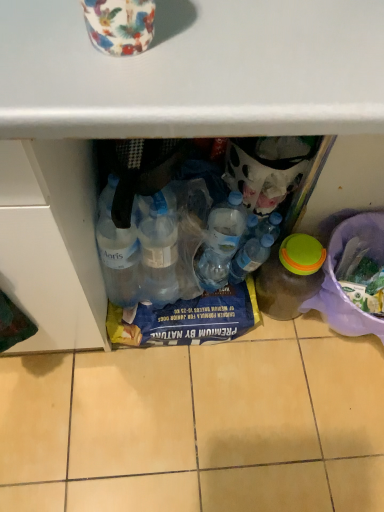
Question: Should I look upward or downward to see transparent plastic bottle at center, positioned as the second bottle in right-to-left order?

Choices:
 (A) up
 (B) down

Answer: (B)

Question: Is transparent plastic bottle at center, positioned as the second bottle in right-to-left order, thinner than transparent plastic bottle at lower right, marked as the second bottle in a left-to-right arrangement?

Choices:
 (A) yes
 (B) no

Answer: (A)

Question: From a real-world perspective, does transparent plastic bottle at center, positioned as the second bottle in right-to-left order, stand above transparent plastic bottle at lower right, which is the first bottle in right-to-left order?

Choices:
 (A) yes
 (B) no

Answer: (A)

Question: Is transparent plastic bottle at center, positioned as the second bottle in right-to-left order, located outside transparent plastic bottle at lower right, marked as the second bottle in a left-to-right arrangement?

Choices:
 (A) yes
 (B) no

Answer: (A)

Question: Can you confirm if transparent plastic bottle at center, the 1th bottle in the left-to-right sequence, is wider than transparent plastic bottle at lower right, which is the first bottle in right-to-left order?

Choices:
 (A) yes
 (B) no

Answer: (B)

Question: Is transparent plastic bottle at center, the 1th bottle in the left-to-right sequence, positioned behind transparent plastic bottle at lower right, marked as the second bottle in a left-to-right arrangement?

Choices:
 (A) yes
 (B) no

Answer: (A)

Question: Is transparent plastic bottle at center, positioned as the second bottle in right-to-left order, to the left of transparent plastic bottle at lower right, which is the first bottle in right-to-left order, from the viewer's perspective?

Choices:
 (A) yes
 (B) no

Answer: (A)

Question: Can you confirm if transparent plastic bottle at lower right, which is the first bottle in right-to-left order, is taller than transparent plastic bottle at center, positioned as the second bottle in right-to-left order?

Choices:
 (A) no
 (B) yes

Answer: (B)

Question: From the image's perspective, is transparent plastic bottle at lower right, marked as the second bottle in a left-to-right arrangement, on top of transparent plastic bottle at center, the 1th bottle in the left-to-right sequence?

Choices:
 (A) no
 (B) yes

Answer: (A)

Question: From a real-world perspective, is transparent plastic bottle at lower right, which is the first bottle in right-to-left order, positioned over transparent plastic bottle at center, the 1th bottle in the left-to-right sequence, based on gravity?

Choices:
 (A) yes
 (B) no

Answer: (B)

Question: Is transparent plastic bottle at lower right, which is the first bottle in right-to-left order, to the left of transparent plastic bottle at center, the 1th bottle in the left-to-right sequence, from the viewer's perspective?

Choices:
 (A) no
 (B) yes

Answer: (A)

Question: Can you confirm if transparent plastic bottle at lower right, which is the first bottle in right-to-left order, is bigger than transparent plastic bottle at center, positioned as the second bottle in right-to-left order?

Choices:
 (A) no
 (B) yes

Answer: (B)

Question: Is transparent plastic bottle at lower right, marked as the second bottle in a left-to-right arrangement, outside of transparent plastic bottle at center, positioned as the second bottle in right-to-left order?

Choices:
 (A) yes
 (B) no

Answer: (A)

Question: Does point (241, 256) appear closer or farther from the camera than point (322, 276)?

Choices:
 (A) closer
 (B) farther

Answer: (B)